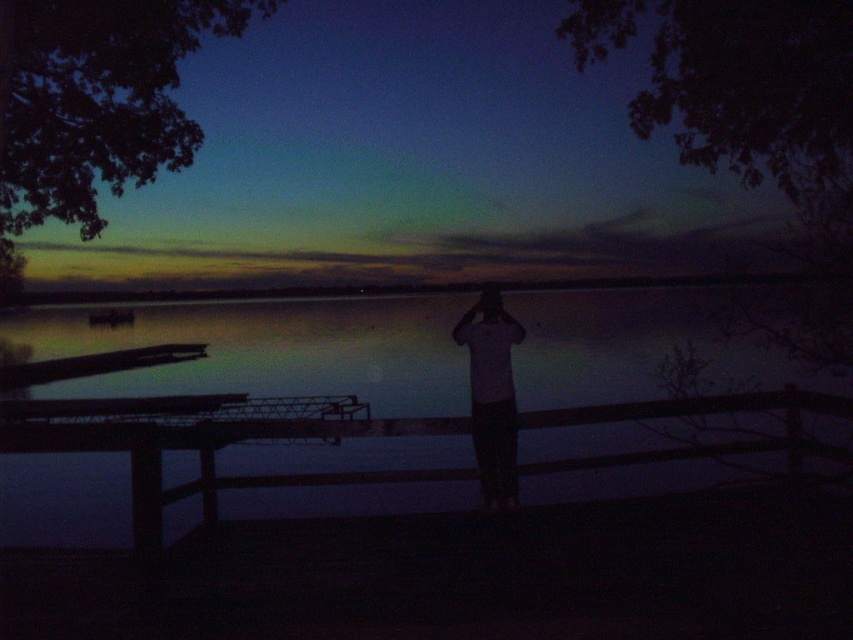
Image resolution: width=853 pixels, height=640 pixels. What do you see at coordinates (241, 419) in the screenshot?
I see `transparent water at center` at bounding box center [241, 419].

Is point (451, 324) positioned in front of point (500, 384)?

No.

Locate an element on the screen. The width and height of the screenshot is (853, 640). transparent water at center is located at coordinates (241, 419).